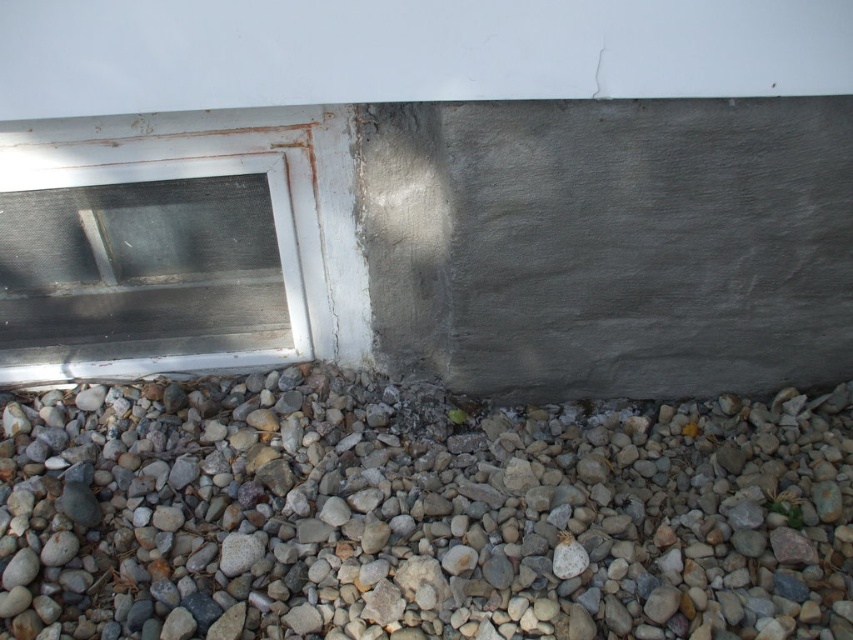
Which of these two, gray gravel at lower center or white plastic window at lower left, stands shorter?

gray gravel at lower center

Does gray gravel at lower center have a larger size compared to white plastic window at lower left?

Correct, gray gravel at lower center is larger in size than white plastic window at lower left.

Does point (834, 387) lie behind point (132, 260)?

Yes, it is.

The width and height of the screenshot is (853, 640). Identify the location of gray gravel at lower center. (418, 515).